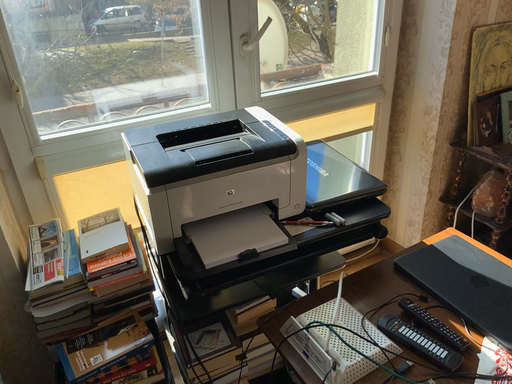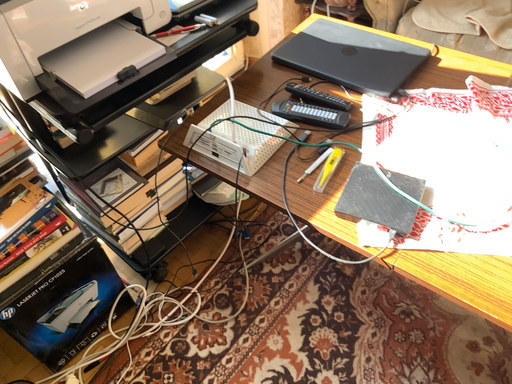
Question: How did the camera likely rotate when shooting the video?

Choices:
 (A) rotated right
 (B) rotated left

Answer: (A)